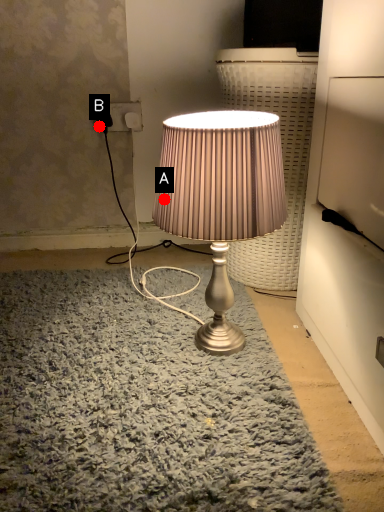
Question: Two points are circled on the image, labeled by A and B beside each circle. Which point is further to the camera?

Choices:
 (A) A is further
 (B) B is further

Answer: (B)